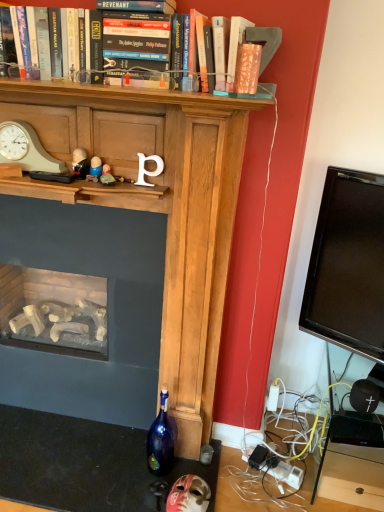
Question: From a real-world perspective, is blue glass bottle at lower center below matte stone figurine at center, acting as the 3th toy starting from the top?

Choices:
 (A) no
 (B) yes

Answer: (B)

Question: Is blue glass bottle at lower center positioned with its back to matte stone figurine at center, acting as the 2th toy starting from the right?

Choices:
 (A) no
 (B) yes

Answer: (A)

Question: Would you say matte stone figurine at center, acting as the 3th toy starting from the top, is part of blue glass bottle at lower center's contents?

Choices:
 (A) yes
 (B) no

Answer: (B)

Question: Can we say blue glass bottle at lower center lies outside matte stone figurine at center, acting as the 2th toy starting from the right?

Choices:
 (A) yes
 (B) no

Answer: (A)

Question: Is blue glass bottle at lower center closer to camera compared to matte stone figurine at center, acting as the 3th toy starting from the top?

Choices:
 (A) no
 (B) yes

Answer: (A)

Question: From a real-world perspective, relative to matte pink mask at lower center, marked as the fourth toy in a left-to-right arrangement, is matte plastic figurine at center, which is the third toy in front-to-back order, vertically above or below?

Choices:
 (A) below
 (B) above

Answer: (B)

Question: From the image's perspective, relative to matte pink mask at lower center, the 4th toy positioned from the front, is matte plastic figurine at center, acting as the 2th toy starting from the back, above or below?

Choices:
 (A) above
 (B) below

Answer: (A)

Question: Would you say matte plastic figurine at center, which is counted as the second toy, starting from the left, is inside or outside matte pink mask at lower center, which appears as the first toy when viewed from the right?

Choices:
 (A) outside
 (B) inside

Answer: (A)

Question: In terms of width, does matte plastic figurine at center, which is counted as the second toy, starting from the left, look wider or thinner when compared to matte pink mask at lower center, which appears as the first toy when viewed from the right?

Choices:
 (A) wide
 (B) thin

Answer: (B)

Question: Based on their sizes in the image, would you say matte black figurine at center, the 2th toy in the front-to-back sequence, is bigger or smaller than black matte speaker at lower right?

Choices:
 (A) small
 (B) big

Answer: (A)

Question: Considering the positions of point (82, 158) and point (365, 387), is point (82, 158) closer or farther from the camera than point (365, 387)?

Choices:
 (A) closer
 (B) farther

Answer: (A)

Question: Choose the correct answer: Is matte black figurine at center, positioned as the fourth toy in right-to-left order, inside black matte speaker at lower right or outside it?

Choices:
 (A) outside
 (B) inside

Answer: (A)

Question: From a real-world perspective, is matte black figurine at center, the 2th toy in the front-to-back sequence, above or below black matte speaker at lower right?

Choices:
 (A) above
 (B) below

Answer: (A)

Question: From a real-world perspective, is matte pink paper at upper center physically located above or below matte beige clock at left?

Choices:
 (A) below
 (B) above

Answer: (B)

Question: From the image's perspective, relative to matte beige clock at left, is matte pink paper at upper center above or below?

Choices:
 (A) above
 (B) below

Answer: (A)